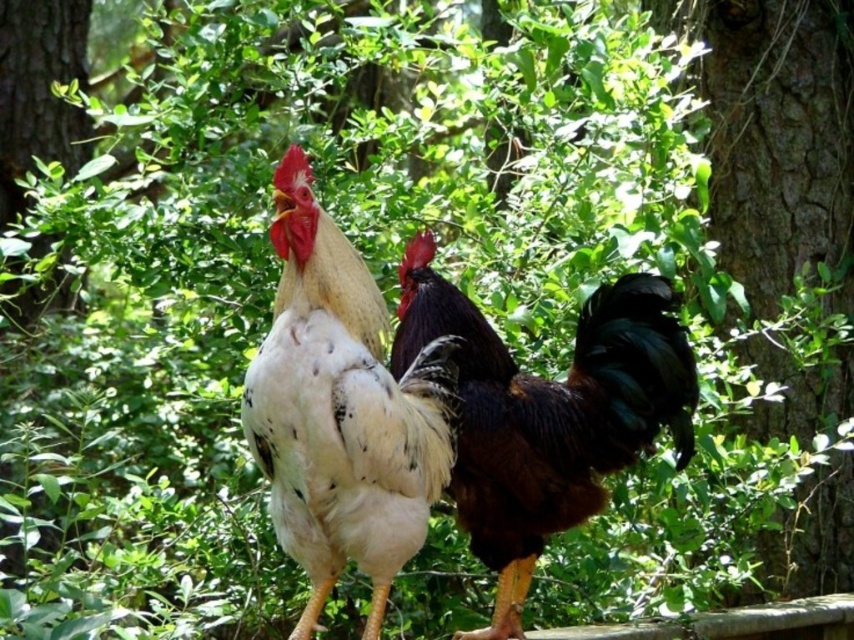
Who is more distant from viewer, (805, 435) or (499, 339)?

The point (805, 435) is more distant.

Measure the distance from rough bark tree at right to shiny black rooster at center.

4.73 feet

Find the location of `rough bark tree at right`. rough bark tree at right is located at coordinates (776, 138).

This screenshot has height=640, width=854. I want to click on rough bark tree at right, so click(776, 138).

Can you confirm if rough bark tree at right is positioned above white speckled feathers at center?

Yes.

Is rough bark tree at right further to the viewer compared to white speckled feathers at center?

Yes, rough bark tree at right is further from the viewer.

Is point (812, 554) positioned after point (378, 506)?

Yes, point (812, 554) is farther from viewer.

The height and width of the screenshot is (640, 854). I want to click on rough bark tree at right, so [x=776, y=138].

Does white speckled feathers at center lie behind shiny black rooster at center?

No, white speckled feathers at center is closer to the viewer.

Measure the distance between white speckled feathers at center and camera.

1.99 meters

The image size is (854, 640). Describe the element at coordinates (342, 410) in the screenshot. I see `white speckled feathers at center` at that location.

Image resolution: width=854 pixels, height=640 pixels. Identify the location of white speckled feathers at center. (342, 410).